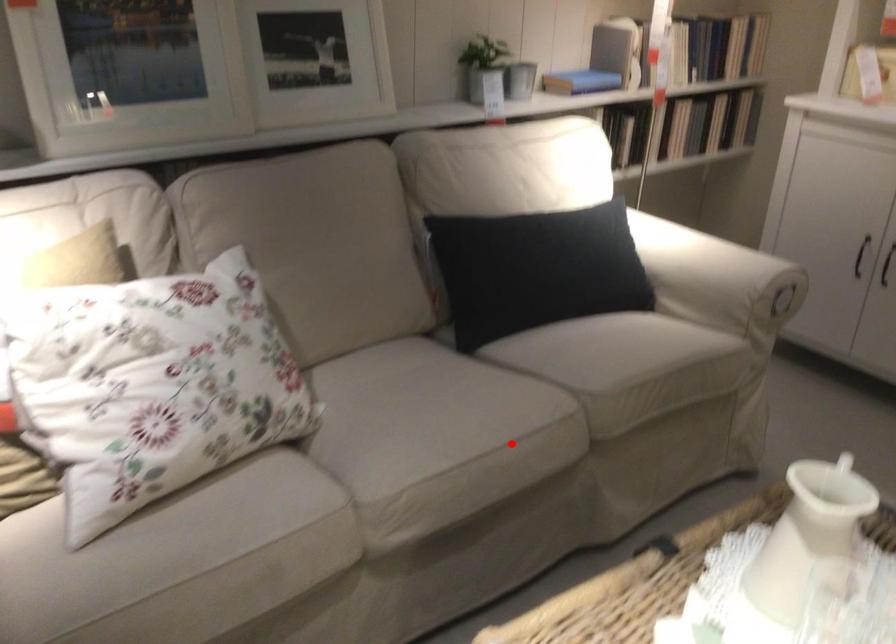
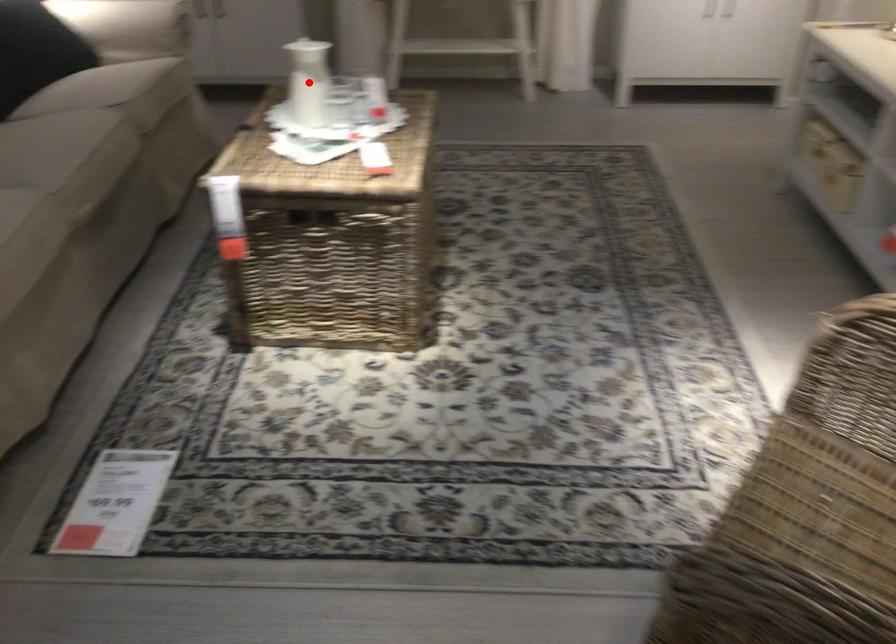
I am providing you with two images of the same scene from different viewpoints. A red point is marked on the first image and another point is marked on the second image. Is the red point in image1 aligned with the point shown in image2?

No